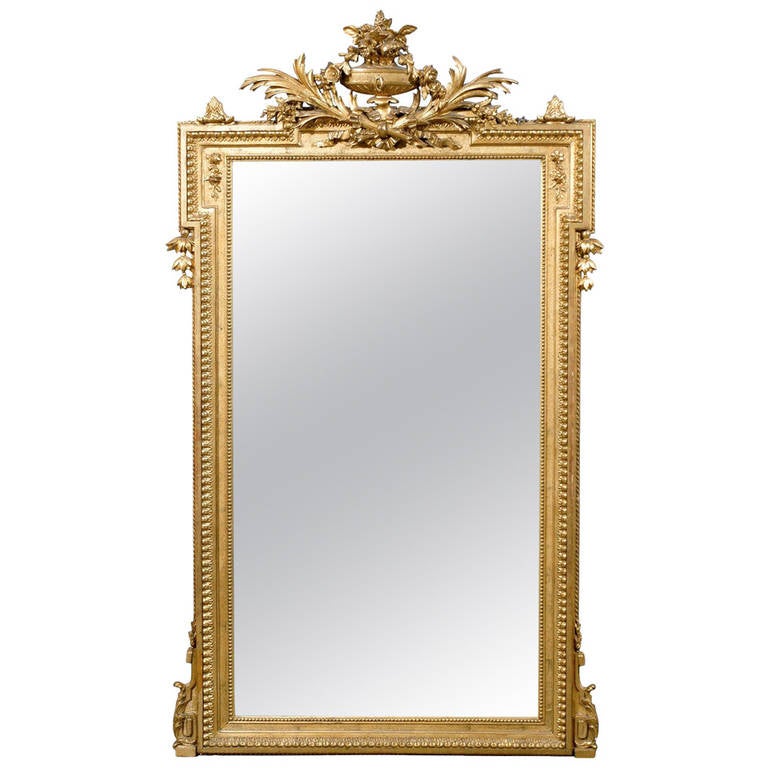
Where is `mirror`? The width and height of the screenshot is (768, 768). mirror is located at coordinates [480, 468].